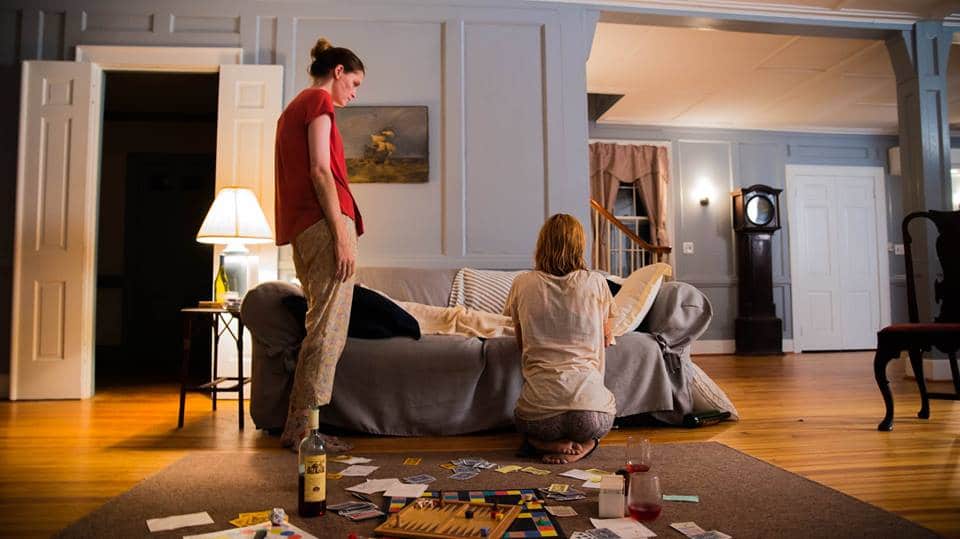
The width and height of the screenshot is (960, 539). I want to click on column, so click(x=923, y=110).